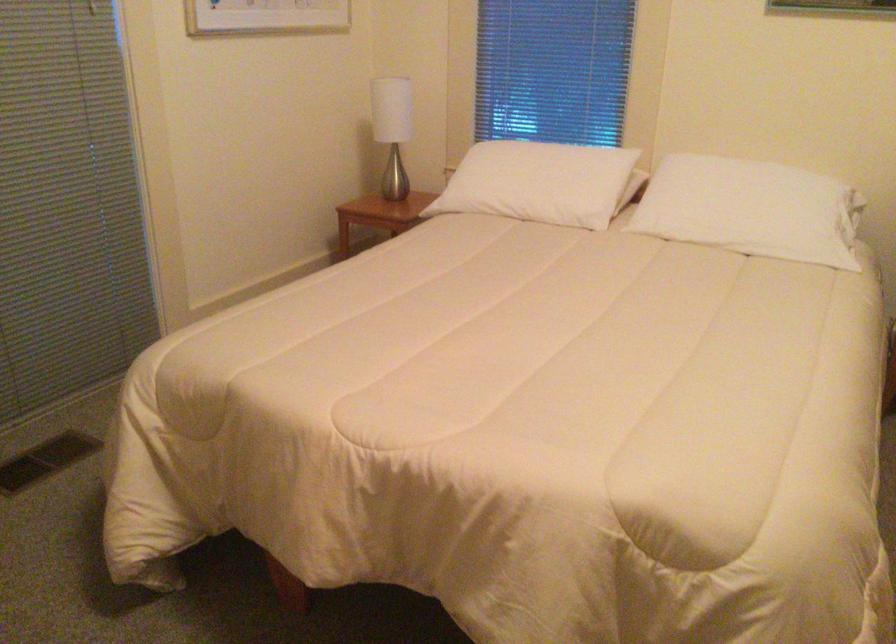
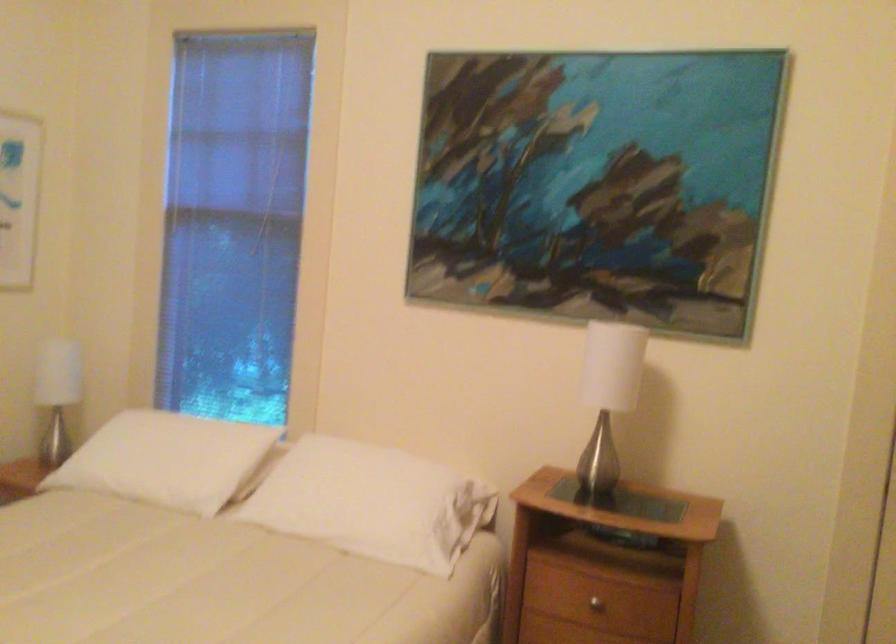
Question: I am providing you with two images of the same scene from different viewpoints. After the viewpoint changes to image2, which objects are now occluded?

Choices:
 (A) silver table lamp
 (B) window blind cord
 (C) white pillow
 (D) none of these

Answer: (D)